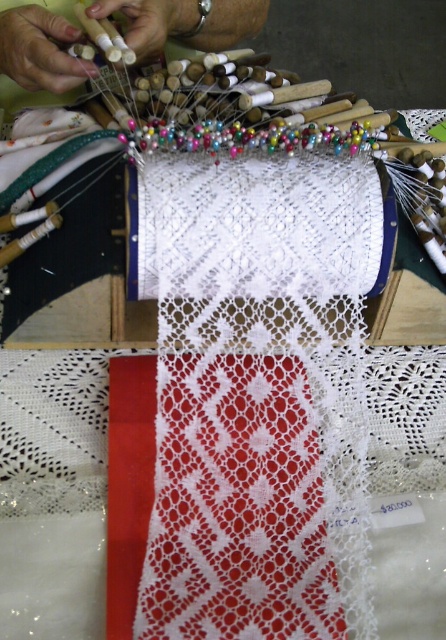
Question: Which point is farther to the camera?

Choices:
 (A) (50, 26)
 (B) (139, 61)

Answer: (B)

Question: Is the position of matte white hand at upper left more distant than that of white matte wooden sticks at upper center?

Choices:
 (A) no
 (B) yes

Answer: (A)

Question: Can you confirm if matte white hand at upper left is positioned above white matte wooden sticks at upper center?

Choices:
 (A) yes
 (B) no

Answer: (B)

Question: Where is matte white hand at upper left located in relation to white matte wooden sticks at upper center in the image?

Choices:
 (A) below
 (B) above

Answer: (A)

Question: Which of the following is the closest to the observer?

Choices:
 (A) white matte wooden sticks at upper center
 (B) matte white hand at upper left

Answer: (B)